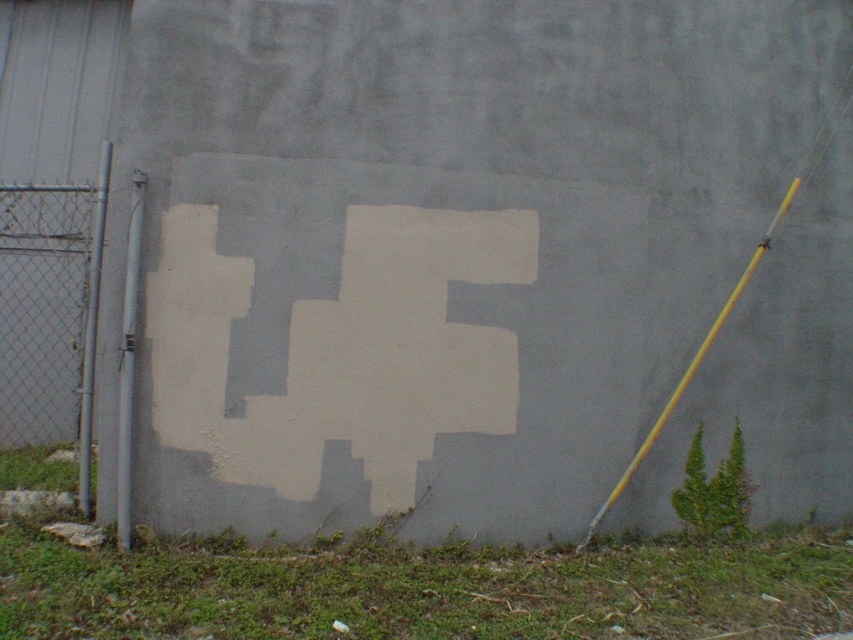
Question: Is white matte cross at center smaller than brushed metal fence at left?

Choices:
 (A) no
 (B) yes

Answer: (B)

Question: Is white matte cross at center further to the viewer compared to brushed metal fence at left?

Choices:
 (A) no
 (B) yes

Answer: (A)

Question: Does white matte cross at center appear under brushed metal fence at left?

Choices:
 (A) yes
 (B) no

Answer: (A)

Question: Among these objects, which one is farthest from the camera?

Choices:
 (A) white matte cross at center
 (B) brushed metal fence at left

Answer: (B)

Question: Which of the following is the farthest from the observer?

Choices:
 (A) white matte cross at center
 (B) brushed metal fence at left

Answer: (B)